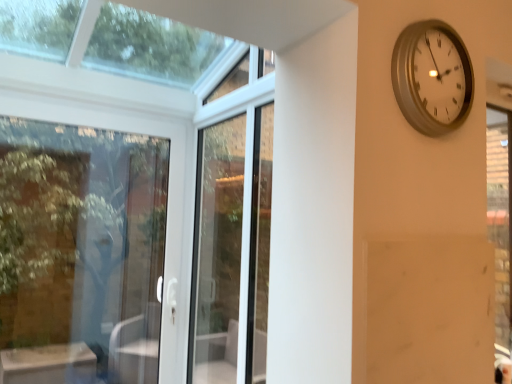
At what (x,y) coordinates should I click in order to perform the action: click on clear glass door at left. Please return your answer as a coordinate pair (x, y). The height and width of the screenshot is (384, 512). Looking at the image, I should click on (104, 234).

From a real-world perspective, between silver metallic clock at upper right and clear glass door at left, who is vertically higher?

silver metallic clock at upper right, from a real-world perspective.

Is silver metallic clock at upper right not within clear glass door at left?

silver metallic clock at upper right lies outside clear glass door at left's area.

Considering the sizes of objects silver metallic clock at upper right and clear glass door at left in the image provided, who is bigger, silver metallic clock at upper right or clear glass door at left?

With larger size is clear glass door at left.

From the image's perspective, between silver metallic clock at upper right and clear glass door at left, who is located below?

clear glass door at left.

Does white glass screen door at center appear on the left side of silver metallic clock at upper right?

Correct, you'll find white glass screen door at center to the left of silver metallic clock at upper right.

Between white glass screen door at center and silver metallic clock at upper right, which one has larger width?

white glass screen door at center is wider.

Looking at this image, from the image's perspective, is white glass screen door at center above or below silver metallic clock at upper right?

Clearly, from the image's perspective, white glass screen door at center is below silver metallic clock at upper right.

Is clear glass door at left oriented away from silver metallic clock at upper right?

clear glass door at left does not have its back to silver metallic clock at upper right.

From the picture: Would you say silver metallic clock at upper right is part of clear glass door at left's contents?

Definitely not — silver metallic clock at upper right is not inside clear glass door at left.

What are the coordinates of `wall clock that appears above the clear glass door at left (from a real-world perspective)` in the screenshot? It's located at (432, 77).

Relative to silver metallic clock at upper right, is clear glass door at left in front or behind?

Answer: Visually, clear glass door at left is located behind silver metallic clock at upper right.

In the scene shown: Can you confirm if white glass screen door at center is positioned to the left of clear glass door at left?

Incorrect, white glass screen door at center is not on the left side of clear glass door at left.

You are a GUI agent. You are given a task and a screenshot of the screen. Output one action in this format:
    pyautogui.click(x=<x>, y=<y>)
    Task: Click on the screen door that is above the clear glass door at left (from the image's perspective)
    
    Given the screenshot: What is the action you would take?
    pyautogui.click(x=232, y=250)

Is point (270, 217) positioned behind point (95, 239)?

No, (270, 217) is closer to viewer.

From a real-world perspective, relative to clear glass door at left, is white glass screen door at center vertically above or below?

In terms of real-world spatial position, white glass screen door at center is above clear glass door at left.

Is silver metallic clock at upper right wider than white glass screen door at center?

In fact, silver metallic clock at upper right might be narrower than white glass screen door at center.

Is silver metallic clock at upper right looking in the opposite direction of white glass screen door at center?

Correct, silver metallic clock at upper right is looking away from white glass screen door at center.

From the image's perspective, is silver metallic clock at upper right on white glass screen door at center?

Indeed, from the image's perspective, silver metallic clock at upper right is shown above white glass screen door at center.

From the picture: Between clear glass door at left and white glass screen door at center, which one has larger size?

With larger size is white glass screen door at center.

Is point (95, 287) in front of point (263, 288)?

No.

Considering their positions, is clear glass door at left located in front of or behind white glass screen door at center?

Visually, clear glass door at left is located behind white glass screen door at center.

Based on their positions, is clear glass door at left located to the left or right of white glass screen door at center?

In the image, clear glass door at left appears on the left side of white glass screen door at center.

At what (x,y) coordinates should I click in order to perform the action: click on wall clock in front of the clear glass door at left. Please return your answer as a coordinate pair (x, y). Looking at the image, I should click on (432, 77).

Where is `screen door to the left of silver metallic clock at upper right`? The width and height of the screenshot is (512, 384). screen door to the left of silver metallic clock at upper right is located at coordinates (232, 250).

When comparing their distances from clear glass door at left, does silver metallic clock at upper right or white glass screen door at center seem closer?

Among the two, white glass screen door at center is located nearer to clear glass door at left.

Looking at the image, which one is located further to white glass screen door at center, silver metallic clock at upper right or clear glass door at left?

clear glass door at left is positioned further to the anchor white glass screen door at center.

Estimate the real-world distances between objects in this image. Which object is further from white glass screen door at center, clear glass door at left or silver metallic clock at upper right?

clear glass door at left.

Estimate the real-world distances between objects in this image. Which object is closer to silver metallic clock at upper right, white glass screen door at center or clear glass door at left?

white glass screen door at center lies closer to silver metallic clock at upper right than the other object.

From the image, which object appears to be nearer to clear glass door at left, white glass screen door at center or silver metallic clock at upper right?

white glass screen door at center.

When comparing their distances from silver metallic clock at upper right, does clear glass door at left or white glass screen door at center seem further?

clear glass door at left is further to silver metallic clock at upper right.

Where is `screen door between clear glass door at left and silver metallic clock at upper right in the horizontal direction`? screen door between clear glass door at left and silver metallic clock at upper right in the horizontal direction is located at coordinates (232, 250).